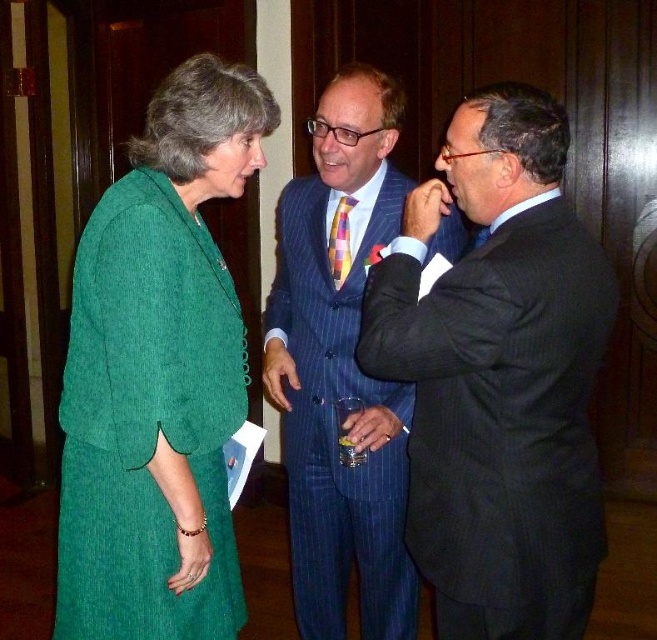
Based on the photo, which is below, dark blue pinstripe suit at center or green corduroy dress at left?

dark blue pinstripe suit at center

Between dark blue pinstripe suit at center and green corduroy dress at left, which one has more height?

Standing taller between the two is green corduroy dress at left.

Which is in front, point (419, 227) or point (85, 300)?

Positioned in front is point (419, 227).

Find the location of a particular element. dark blue pinstripe suit at center is located at coordinates (499, 376).

The height and width of the screenshot is (640, 657). Describe the element at coordinates (158, 374) in the screenshot. I see `green corduroy dress at left` at that location.

Between green corduroy dress at left and blue pinstripe suit at center, which one appears on the right side from the viewer's perspective?

blue pinstripe suit at center is more to the right.

Between point (83, 451) and point (373, 600), which one is positioned in front?

Positioned in front is point (83, 451).

Locate an element on the screen. green corduroy dress at left is located at coordinates (158, 374).

Can you confirm if blue pinstripe suit at center is positioned above multicolored woven tie at center?

Incorrect, blue pinstripe suit at center is not positioned above multicolored woven tie at center.

Can you confirm if blue pinstripe suit at center is thinner than multicolored woven tie at center?

Incorrect, blue pinstripe suit at center's width is not less than multicolored woven tie at center's.

Between point (298, 417) and point (350, 205), which one is positioned in front?

Point (350, 205) is in front.

I want to click on blue pinstripe suit at center, so click(x=342, y=371).